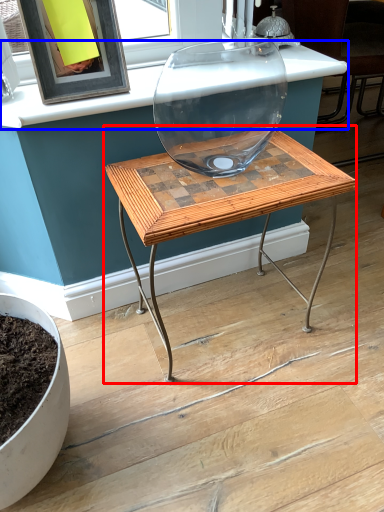
Question: Which point is further to the camera, table (highlighted by a red box) or counter top (highlighted by a blue box)?

Choices:
 (A) table
 (B) counter top

Answer: (B)